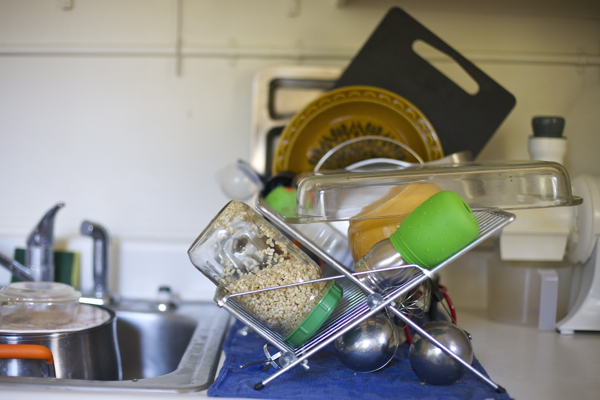
At what (x,y) coordinates should I click in order to perform the action: click on sprayer for faucet. Please return your answer as a coordinate pair (x, y). The height and width of the screenshot is (400, 600). Looking at the image, I should click on (101, 252).